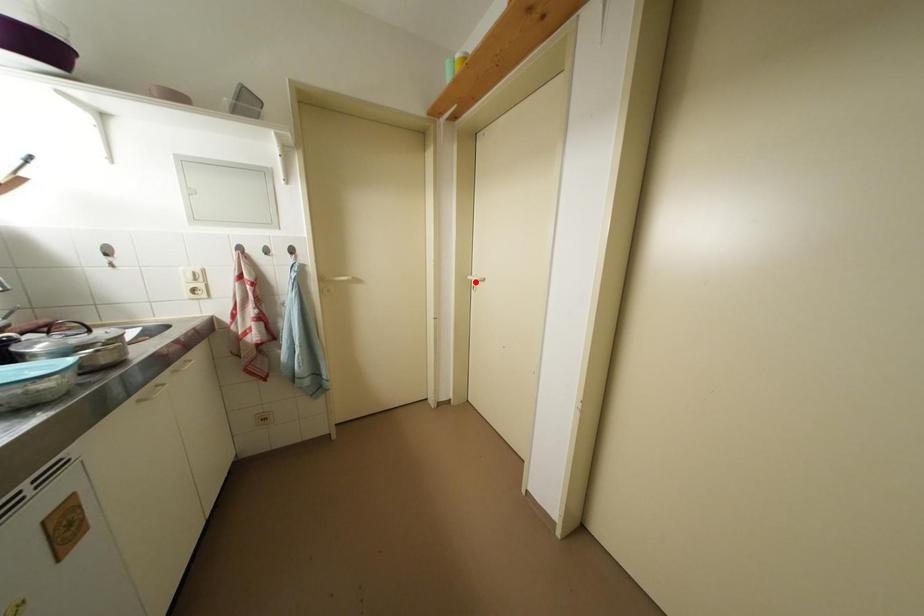
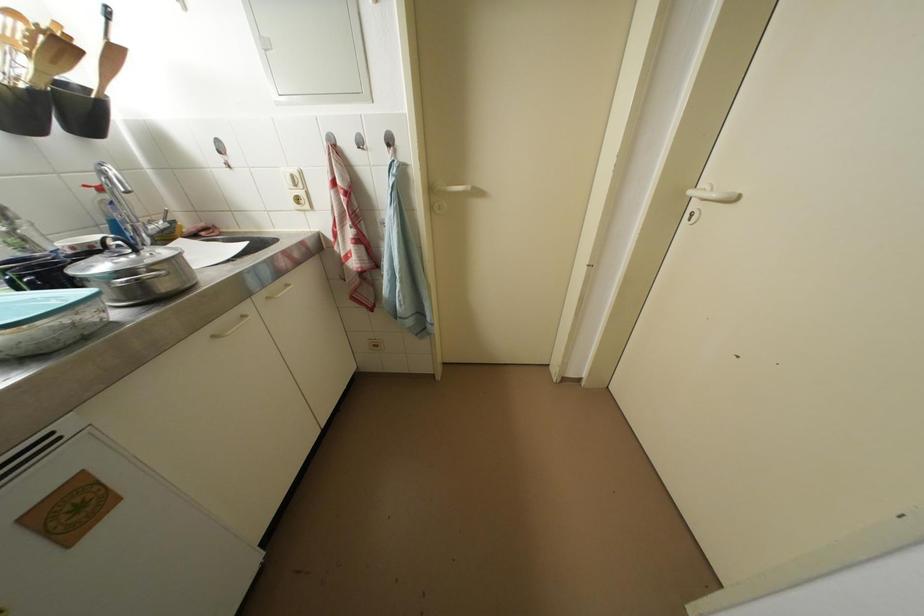
Where in the second image is the point corresponding to the highlighted location from the first image?

(698, 197)